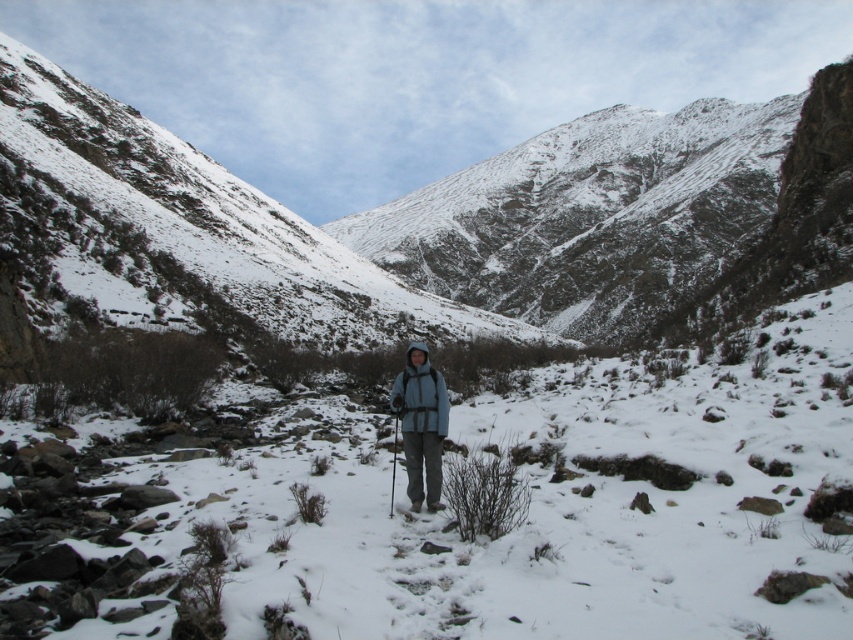
Question: Observing the image, what is the correct spatial positioning of blue fleece jacket at center in reference to metallic silver ski pole at center?

Choices:
 (A) left
 (B) right

Answer: (B)

Question: Which point is closer to the camera?

Choices:
 (A) (392, 486)
 (B) (421, 388)

Answer: (B)

Question: Which object appears closest to the camera in this image?

Choices:
 (A) metallic silver ski pole at center
 (B) blue fleece jacket at center

Answer: (A)

Question: Does blue fleece jacket at center appear on the left side of metallic silver ski pole at center?

Choices:
 (A) yes
 (B) no

Answer: (B)

Question: Does blue fleece jacket at center appear on the left side of metallic silver ski pole at center?

Choices:
 (A) yes
 (B) no

Answer: (B)

Question: Which of the following is the farthest from the observer?

Choices:
 (A) (425, 477)
 (B) (392, 497)

Answer: (B)